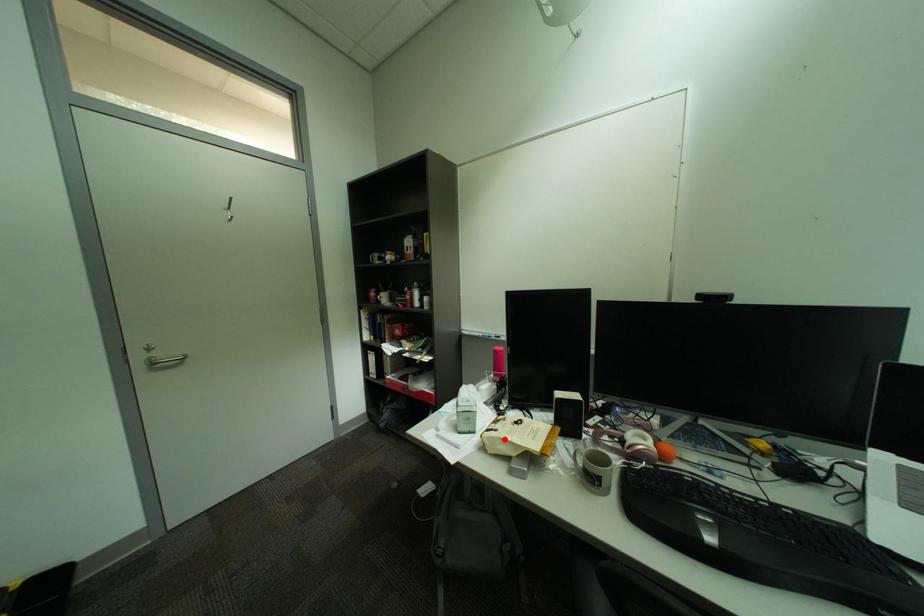
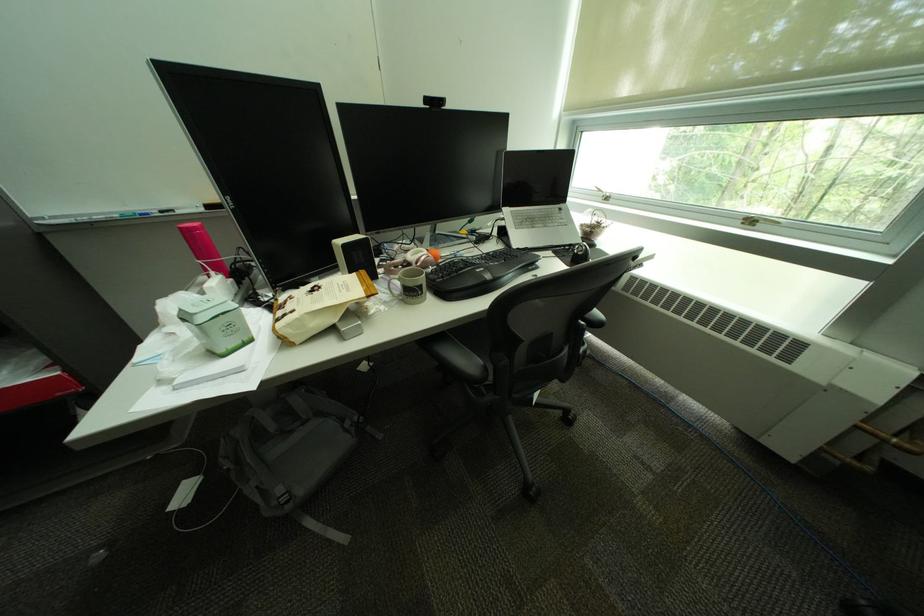
In the second image, find the point that corresponds to the highlighted location in the first image.

(309, 321)